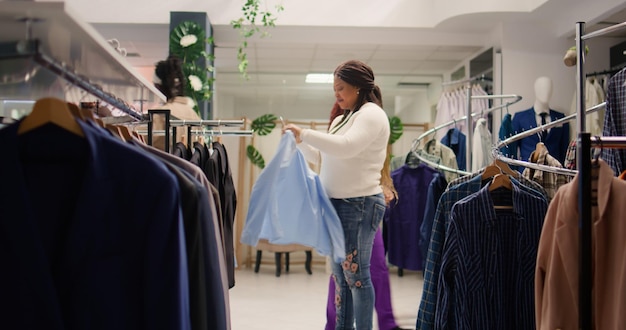
Image resolution: width=626 pixels, height=330 pixels. Find the location of `empty floor`. empty floor is located at coordinates (270, 300).